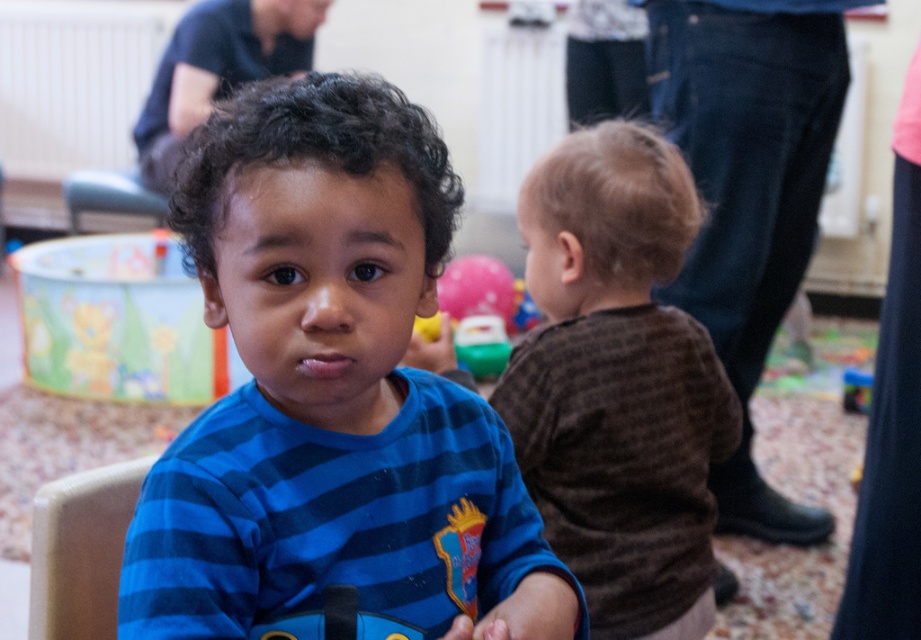
You are a photographer trying to capture a photo of the blue striped shirt at center and the pink rubber balloon at upper center. Which object should you focus on first if you want to ensure both are in focus?

The blue striped shirt at center is below the pink rubber balloon at upper center, so you should focus on the pink rubber balloon at upper center first to ensure both are in focus.